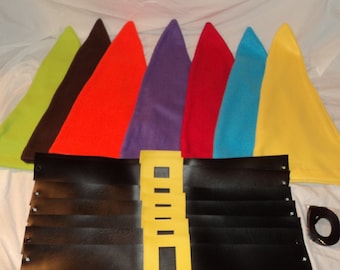
This screenshot has width=340, height=270. In order to click on table cloth in this screenshot , I will do `click(312, 199)`.